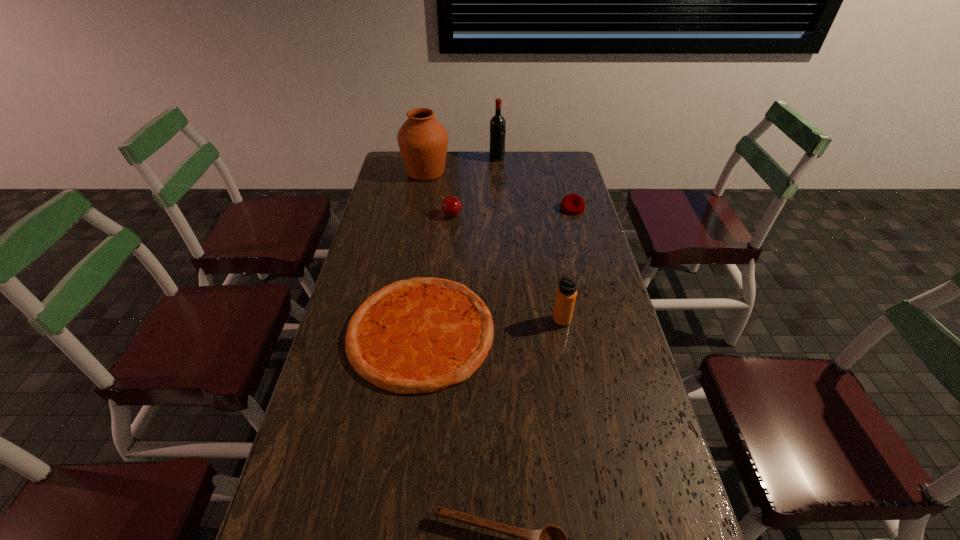
The height and width of the screenshot is (540, 960). I want to click on object that is at the far left corner, so click(423, 140).

Find the location of `vacant space at the far edge of the desktop`. vacant space at the far edge of the desktop is located at coordinates (467, 158).

At what (x,y) coordinates should I click in order to perform the action: click on free spot at the left edge of the desktop. Please return your answer as a coordinate pair (x, y). This screenshot has width=960, height=540. Looking at the image, I should click on tap(320, 389).

You are a GUI agent. You are given a task and a screenshot of the screen. Output one action in this format:
    pyautogui.click(x=<x>, y=<y>)
    Task: Click on the free space at the right edge of the desktop
    The height and width of the screenshot is (540, 960).
    Given the screenshot: What is the action you would take?
    pyautogui.click(x=547, y=181)

Find the location of a particular element. The height and width of the screenshot is (540, 960). free space at the far left corner is located at coordinates (396, 160).

This screenshot has height=540, width=960. Find the location of `blank space at the far right corner of the desktop`. blank space at the far right corner of the desktop is located at coordinates (574, 161).

The height and width of the screenshot is (540, 960). In order to click on vacant space that is in between the cherry and the third tallest object in this screenshot , I will do `click(507, 268)`.

Find the location of a particular element. free space between the third tallest object and the wine bottle is located at coordinates (529, 240).

Locate an element on the screen. The height and width of the screenshot is (540, 960). free spot between the pizza and the wine bottle is located at coordinates (459, 245).

The width and height of the screenshot is (960, 540). Find the location of `free space between the fifth tallest object and the sixth object from left to right`. free space between the fifth tallest object and the sixth object from left to right is located at coordinates (567, 265).